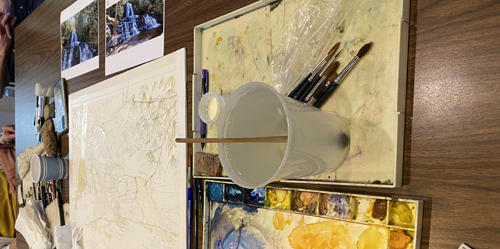
Where is `table`? This screenshot has width=500, height=249. table is located at coordinates (438, 177).